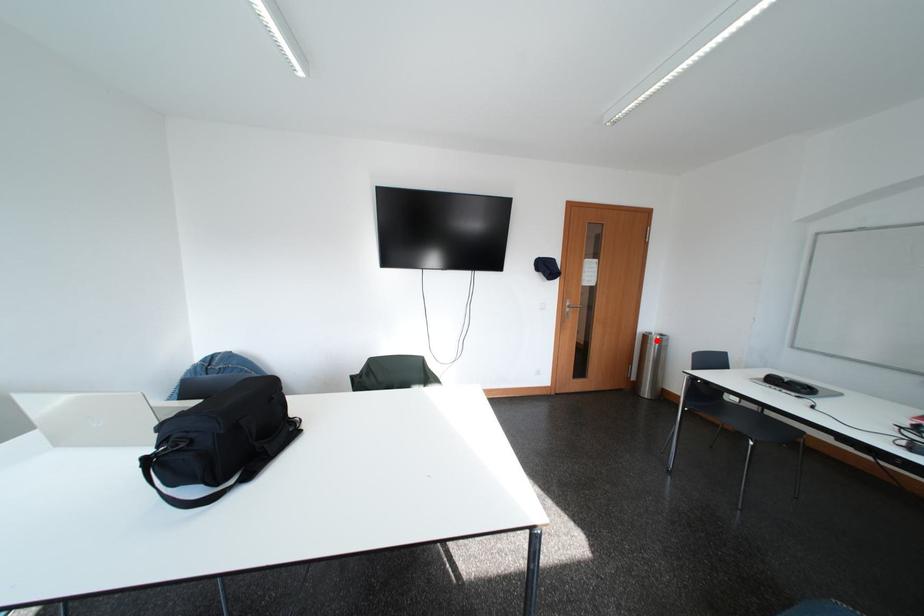
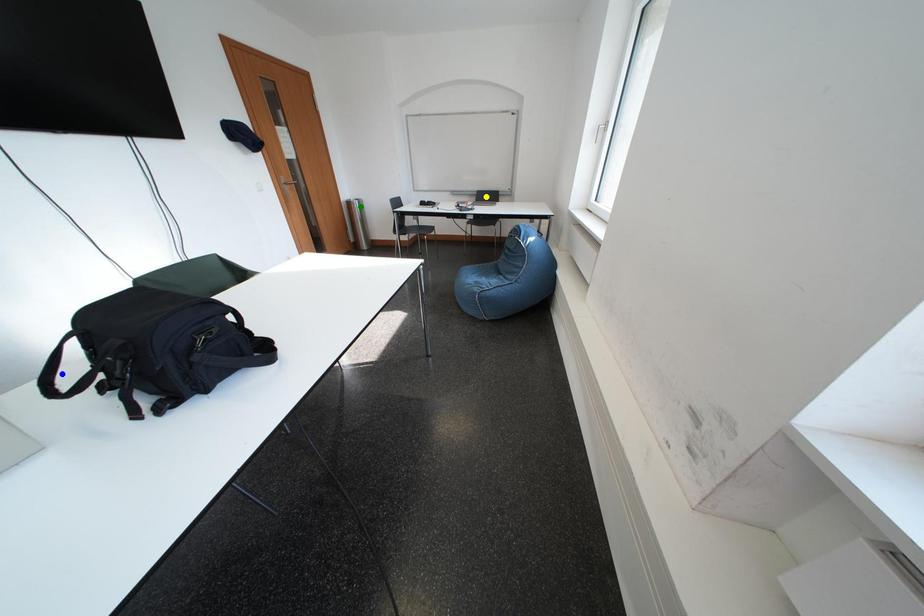
Question: I am providing you with two images of the same scene from different viewpoints. A red point is marked on the first image. You are given multiple points on the second image. Can you choose the point in image 2 that corresponds to the point in image 1?

Choices:
 (A) green point
 (B) blue point
 (C) yellow point

Answer: (A)